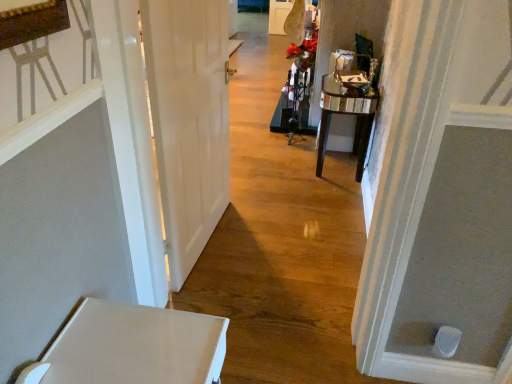
This screenshot has width=512, height=384. Describe the element at coordinates (132, 347) in the screenshot. I see `white matte drawer at lower left` at that location.

The width and height of the screenshot is (512, 384). What are the coordinates of `white matte drawer at lower left` in the screenshot? It's located at (132, 347).

At what (x,y) coordinates should I click in order to perform the action: click on white matte drawer at lower left. Please return your answer as a coordinate pair (x, y). Looking at the image, I should click on (132, 347).